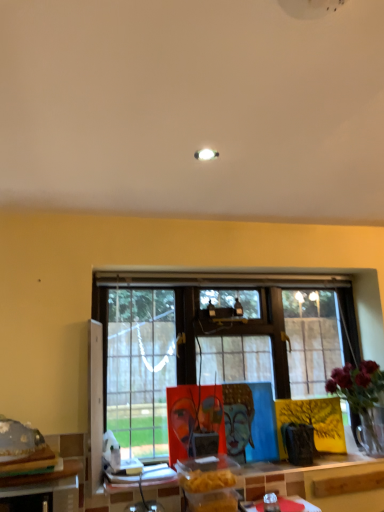
Question: Is shiny metallic food at lower left facing towards wooden table at lower left, the 2th table from the right?

Choices:
 (A) yes
 (B) no

Answer: (B)

Question: From a real-world perspective, is shiny metallic food at lower left on top of wooden table at lower left, which is the 2th table in back-to-front order?

Choices:
 (A) no
 (B) yes

Answer: (B)

Question: Is shiny metallic food at lower left next to wooden table at lower left, which is the 1th table from left to right, and touching it?

Choices:
 (A) yes
 (B) no

Answer: (B)

Question: Is the position of shiny metallic food at lower left more distant than that of wooden table at lower left, which is the 2th table in back-to-front order?

Choices:
 (A) yes
 (B) no

Answer: (A)

Question: Is shiny metallic food at lower left wider than wooden table at lower left, the 1th table from the front?

Choices:
 (A) yes
 (B) no

Answer: (B)

Question: Is shiny metallic food at lower left turned away from wooden table at lower left, which is the 1th table from left to right?

Choices:
 (A) yes
 (B) no

Answer: (B)

Question: Considering the relative sizes of wooden table at lower center, arranged as the 2th table when viewed from the front, and wooden table at lower left, the 1th table from the front, in the image provided, is wooden table at lower center, arranged as the 2th table when viewed from the front, bigger than wooden table at lower left, the 1th table from the front,?

Choices:
 (A) yes
 (B) no

Answer: (B)

Question: Is wooden table at lower center, acting as the first table starting from the back, with wooden table at lower left, which is the 1th table from left to right?

Choices:
 (A) yes
 (B) no

Answer: (B)

Question: Is wooden table at lower left, the 1th table from the front, located within wooden table at lower center, arranged as the 2th table when viewed from the front?

Choices:
 (A) no
 (B) yes

Answer: (A)

Question: Is wooden table at lower center, the 1th table positioned from the right, at the left side of wooden table at lower left, which is the 1th table from left to right?

Choices:
 (A) no
 (B) yes

Answer: (A)

Question: From the image's perspective, is wooden table at lower center, arranged as the 2th table when viewed from the front, on top of wooden table at lower left, the 2th table from the right?

Choices:
 (A) no
 (B) yes

Answer: (A)

Question: Can we say wooden table at lower center, the 1th table positioned from the right, lies outside wooden table at lower left, the 2th table from the right?

Choices:
 (A) yes
 (B) no

Answer: (A)

Question: Would you consider wooden table at lower left, the 2th table from the right, to be distant from wooden table at lower center, acting as the first table starting from the back?

Choices:
 (A) no
 (B) yes

Answer: (B)